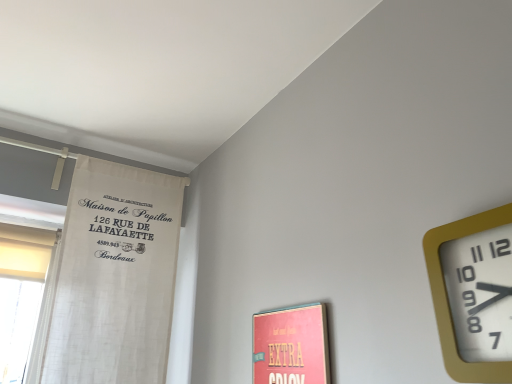
Question: Can we say gold plastic wall clock at upper right lies outside white fabric curtain at left?

Choices:
 (A) yes
 (B) no

Answer: (A)

Question: Can you confirm if gold plastic wall clock at upper right is bigger than white fabric curtain at left?

Choices:
 (A) no
 (B) yes

Answer: (A)

Question: Does gold plastic wall clock at upper right appear on the right side of white fabric curtain at left?

Choices:
 (A) no
 (B) yes

Answer: (B)

Question: Is the depth of gold plastic wall clock at upper right greater than that of white fabric curtain at left?

Choices:
 (A) yes
 (B) no

Answer: (B)

Question: From the image's perspective, would you say gold plastic wall clock at upper right is positioned over white fabric curtain at left?

Choices:
 (A) yes
 (B) no

Answer: (A)

Question: From a real-world perspective, is gold plastic wall clock at upper right physically below white fabric curtain at left?

Choices:
 (A) yes
 (B) no

Answer: (A)

Question: Can you confirm if white fabric curtain at left is positioned to the right of gold plastic wall clock at upper right?

Choices:
 (A) no
 (B) yes

Answer: (A)

Question: Is white fabric curtain at left oriented towards gold plastic wall clock at upper right?

Choices:
 (A) no
 (B) yes

Answer: (B)

Question: Is white fabric curtain at left not within gold plastic wall clock at upper right?

Choices:
 (A) no
 (B) yes

Answer: (B)

Question: Is white fabric curtain at left positioned before gold plastic wall clock at upper right?

Choices:
 (A) yes
 (B) no

Answer: (B)

Question: From a real-world perspective, is white fabric curtain at left under gold plastic wall clock at upper right?

Choices:
 (A) no
 (B) yes

Answer: (A)

Question: Considering the relative sizes of white fabric curtain at left and gold plastic wall clock at upper right in the image provided, is white fabric curtain at left thinner than gold plastic wall clock at upper right?

Choices:
 (A) yes
 (B) no

Answer: (B)

Question: Considering the positions of point (172, 294) and point (445, 289), is point (172, 294) closer or farther from the camera than point (445, 289)?

Choices:
 (A) farther
 (B) closer

Answer: (A)